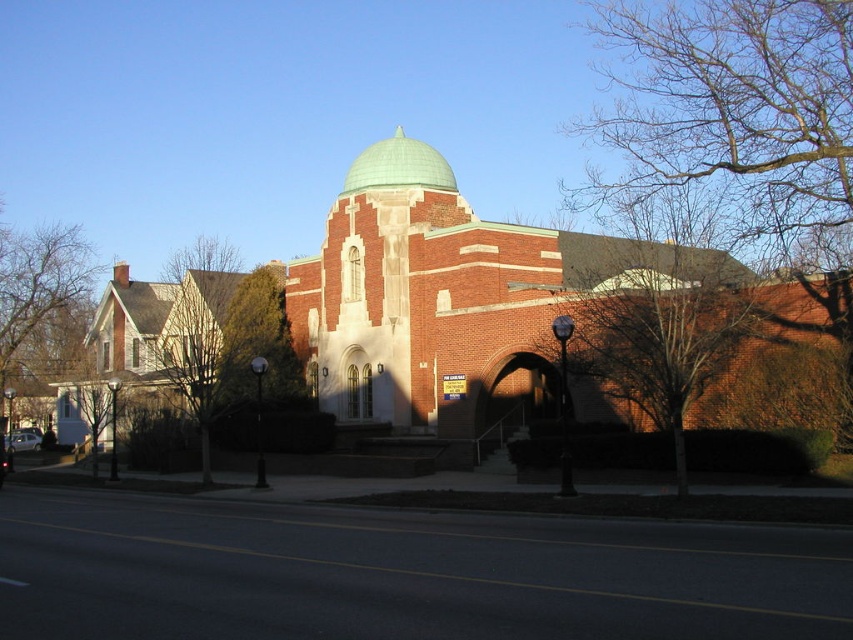
You are standing in front of the brick building and want to take a photo of both the bare branches at upper right and the brown leafless tree at left. Which object should you focus on first to ensure both are in the frame?

You should focus on the bare branches at upper right first because it is closer to the viewer than the brown leafless tree at left, so adjusting the camera to include both would require ensuring the closer object is framed first.

You are standing in front of the brick building and notice a point marked at coordinates (41, 300). What object is located at that point?

The point at coordinates (41, 300) indicates a brown leafless tree at left.

Looking at this image, you are standing in front of the brick building and want to take a photo of the green matte dome at center. However, there are bare branches at upper right in the way. Can you determine if the branches are blocking the view of the dome?

The bare branches at upper right are closer to the viewer than the green matte dome at center, so they are blocking the view of the dome.